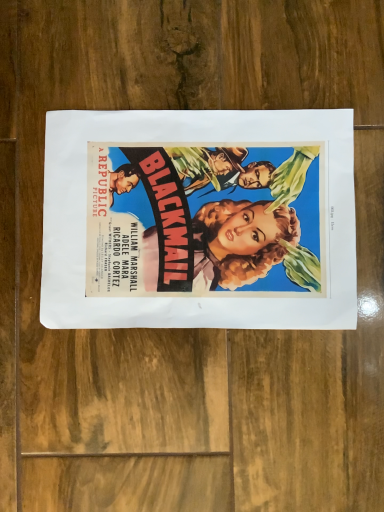
What do you see at coordinates (199, 220) in the screenshot? The width and height of the screenshot is (384, 512). I see `matte paper poster at center` at bounding box center [199, 220].

I want to click on matte paper poster at center, so click(199, 220).

Identify the location of matte paper poster at center. The image size is (384, 512). (199, 220).